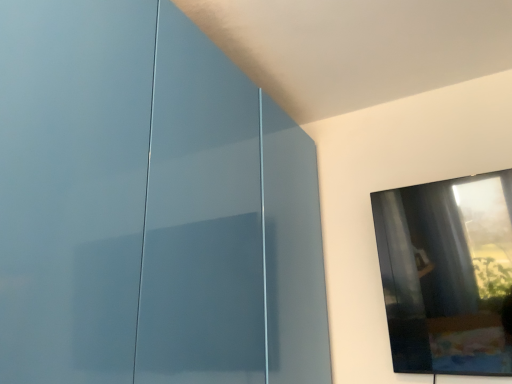
Question: From a real-world perspective, is glossy blue glass door at left physically above transparent glass window at upper right?

Choices:
 (A) no
 (B) yes

Answer: (B)

Question: Does glossy blue glass door at left have a greater width compared to transparent glass window at upper right?

Choices:
 (A) no
 (B) yes

Answer: (B)

Question: Does glossy blue glass door at left have a lesser height compared to transparent glass window at upper right?

Choices:
 (A) yes
 (B) no

Answer: (B)

Question: Does glossy blue glass door at left touch transparent glass window at upper right?

Choices:
 (A) yes
 (B) no

Answer: (B)

Question: Are glossy blue glass door at left and transparent glass window at upper right located far from each other?

Choices:
 (A) yes
 (B) no

Answer: (B)

Question: Is glossy blue glass door at left turned away from transparent glass window at upper right?

Choices:
 (A) yes
 (B) no

Answer: (B)

Question: From a real-world perspective, is transparent glass window at upper right positioned over glossy blue glass door at left based on gravity?

Choices:
 (A) no
 (B) yes

Answer: (A)

Question: Is transparent glass window at upper right at the left side of glossy blue glass door at left?

Choices:
 (A) no
 (B) yes

Answer: (A)

Question: Considering the relative sizes of transparent glass window at upper right and glossy blue glass door at left in the image provided, is transparent glass window at upper right smaller than glossy blue glass door at left?

Choices:
 (A) no
 (B) yes

Answer: (B)

Question: Is transparent glass window at upper right far away from glossy blue glass door at left?

Choices:
 (A) no
 (B) yes

Answer: (A)

Question: Is the position of transparent glass window at upper right more distant than that of glossy blue glass door at left?

Choices:
 (A) yes
 (B) no

Answer: (A)

Question: From the image's perspective, is transparent glass window at upper right under glossy blue glass door at left?

Choices:
 (A) no
 (B) yes

Answer: (B)

Question: Is transparent glass window at upper right inside the boundaries of glossy blue glass door at left, or outside?

Choices:
 (A) outside
 (B) inside

Answer: (A)